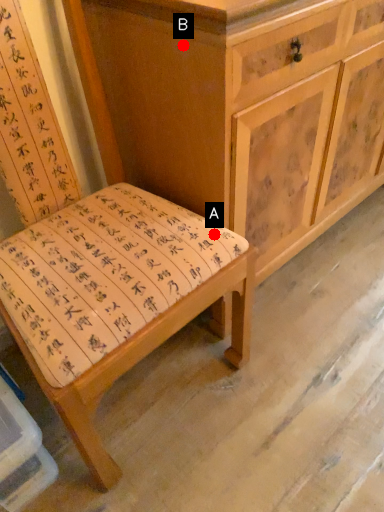
Question: Two points are circled on the image, labeled by A and B beside each circle. Which point is closer to the camera taking this photo?

Choices:
 (A) A is closer
 (B) B is closer

Answer: (B)